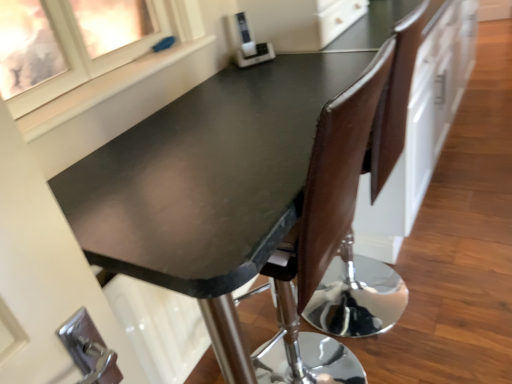
What do you see at coordinates (70, 44) in the screenshot?
I see `matte glass window at upper left` at bounding box center [70, 44].

What do you see at coordinates (248, 44) in the screenshot?
I see `white plastic appliance at upper center` at bounding box center [248, 44].

In the scene shown: In order to face matte black table at center, should I rotate leftwards or rightwards?

You should rotate right by 1.670 degrees.

Locate an element on the screen. The image size is (512, 384). brown leather chair at center is located at coordinates (322, 237).

What do you see at coordinates (322, 237) in the screenshot? I see `brown leather chair at center` at bounding box center [322, 237].

Where is `matte glass window at upper left`? matte glass window at upper left is located at coordinates (70, 44).

Considering the sizes of matte black table at center and white plastic appliance at upper center in the image, is matte black table at center taller or shorter than white plastic appliance at upper center?

matte black table at center is taller than white plastic appliance at upper center.

This screenshot has width=512, height=384. In order to click on appliance that is behind the matte black table at center in this screenshot , I will do `click(248, 44)`.

Is matte black table at center positioned with its back to white plastic appliance at upper center?

That's not correct — matte black table at center is not looking away from white plastic appliance at upper center.

Is matte glass window at upper left facing away from brown leather chair at center?

No, matte glass window at upper left is not facing away from brown leather chair at center.

The height and width of the screenshot is (384, 512). In order to click on window above the brown leather chair at center (from a real-world perspective) in this screenshot , I will do `click(70, 44)`.

Between matte glass window at upper left and brown leather chair at center, which one appears on the left side from the viewer's perspective?

Positioned to the left is matte glass window at upper left.

Considering the sizes of matte glass window at upper left and brown leather chair at center in the image, is matte glass window at upper left taller or shorter than brown leather chair at center?

Considering their sizes, matte glass window at upper left has less height than brown leather chair at center.

Considering the positions of objects matte black table at center and white smooth window sill at upper left in the image provided, who is more to the left, matte black table at center or white smooth window sill at upper left?

From the viewer's perspective, white smooth window sill at upper left appears more on the left side.

From the picture: Between matte black table at center and white smooth window sill at upper left, which one has less height?

white smooth window sill at upper left.

Based on the photo, from the image's perspective, relative to white smooth window sill at upper left, is matte black table at center above or below?

matte black table at center is below white smooth window sill at upper left.

Considering the relative sizes of matte black table at center and white smooth window sill at upper left in the image provided, is matte black table at center thinner than white smooth window sill at upper left?

No.

Looking at this image, considering the sizes of objects white plastic appliance at upper center and matte glass window at upper left in the image provided, who is thinner, white plastic appliance at upper center or matte glass window at upper left?

white plastic appliance at upper center is thinner.

Which of these two, white plastic appliance at upper center or matte glass window at upper left, stands taller?

Standing taller between the two is matte glass window at upper left.

From the image's perspective, which one is positioned lower, white plastic appliance at upper center or matte glass window at upper left?

From the image's view, matte glass window at upper left is below.

From a real-world perspective, does white plastic appliance at upper center stand above matte glass window at upper left?

No, from a real-world perspective, white plastic appliance at upper center is not above matte glass window at upper left.

Considering the relative positions of matte glass window at upper left and white plastic appliance at upper center in the image provided, is matte glass window at upper left to the right of white plastic appliance at upper center from the viewer's perspective?

In fact, matte glass window at upper left is to the left of white plastic appliance at upper center.

From a real-world perspective, is matte glass window at upper left above or below white plastic appliance at upper center?

matte glass window at upper left is situated higher than white plastic appliance at upper center in the real world.

Where is `appliance above the matte glass window at upper left (from the image's perspective)`? appliance above the matte glass window at upper left (from the image's perspective) is located at coordinates (248, 44).

Considering the relative sizes of matte glass window at upper left and white plastic appliance at upper center in the image provided, is matte glass window at upper left taller than white plastic appliance at upper center?

Yes.

Could white smooth window sill at upper left be considered to be inside white plastic appliance at upper center?

That's incorrect, white smooth window sill at upper left is not inside white plastic appliance at upper center.

From the image's perspective, between white plastic appliance at upper center and white smooth window sill at upper left, which one is located above?

white plastic appliance at upper center appears higher in the image.

Considering the sizes of objects white plastic appliance at upper center and white smooth window sill at upper left in the image provided, who is taller, white plastic appliance at upper center or white smooth window sill at upper left?

Standing taller between the two is white plastic appliance at upper center.

Is white plastic appliance at upper center further to the viewer compared to white smooth window sill at upper left?

Yes.

Which object is further away from the camera taking this photo, matte glass window at upper left or white smooth window sill at upper left?

white smooth window sill at upper left.

Consider the image. How far apart are matte glass window at upper left and white smooth window sill at upper left?

The distance of matte glass window at upper left from white smooth window sill at upper left is 1.96 meters.

Is matte glass window at upper left facing towards white smooth window sill at upper left?

No, matte glass window at upper left is not aimed at white smooth window sill at upper left.

You are a GUI agent. You are given a task and a screenshot of the screen. Output one action in this format:
    pyautogui.click(x=<x>, y=<y>)
    Task: Click on the table that appears below the white plastic appliance at upper center (from a real-world perspective)
    This screenshot has width=512, height=384.
    Given the screenshot: What is the action you would take?
    pyautogui.click(x=225, y=181)

You are a GUI agent. You are given a task and a screenshot of the screen. Output one action in this format:
    pyautogui.click(x=<x>, y=<y>)
    Task: Click on the window above the brown leather chair at center (from a real-world perspective)
    The height and width of the screenshot is (384, 512).
    Given the screenshot: What is the action you would take?
    pyautogui.click(x=70, y=44)

Considering their positions, is matte black table at center positioned further to white plastic appliance at upper center than matte glass window at upper left?

Based on the image, matte glass window at upper left appears to be further to white plastic appliance at upper center.

Based on their spatial positions, is matte black table at center or white plastic appliance at upper center further from brown leather chair at center?

white plastic appliance at upper center lies further to brown leather chair at center than the other object.

From the image, which object appears to be farther from brown leather chair at center, white plastic appliance at upper center or matte glass window at upper left?

matte glass window at upper left is further to brown leather chair at center.

Considering their positions, is white plastic appliance at upper center positioned further to matte black table at center than matte glass window at upper left?

The object further to matte black table at center is matte glass window at upper left.

Estimate the real-world distances between objects in this image. Which object is further from white plastic appliance at upper center, brown leather chair at center or matte glass window at upper left?

Based on the image, matte glass window at upper left appears to be further to white plastic appliance at upper center.

Estimate the real-world distances between objects in this image. Which object is closer to matte black table at center, white smooth window sill at upper left or matte glass window at upper left?

Based on the image, white smooth window sill at upper left appears to be nearer to matte black table at center.

Based on their spatial positions, is matte black table at center or white plastic appliance at upper center further from matte glass window at upper left?

matte black table at center is further to matte glass window at upper left.

When comparing their distances from brown leather chair at center, does matte glass window at upper left or white smooth window sill at upper left seem further?

matte glass window at upper left lies further to brown leather chair at center than the other object.

Find the location of a particular element. appliance between matte glass window at upper left and brown leather chair at center from left to right is located at coordinates (248, 44).

Where is `appliance situated between white smooth window sill at upper left and brown leather chair at center from left to right`? appliance situated between white smooth window sill at upper left and brown leather chair at center from left to right is located at coordinates (248, 44).

Identify the location of window sill located between matte glass window at upper left and brown leather chair at center in the left-right direction. Image resolution: width=512 pixels, height=384 pixels. (103, 89).

Locate an element on the screen. window sill located between matte black table at center and white plastic appliance at upper center in the depth direction is located at coordinates (103, 89).